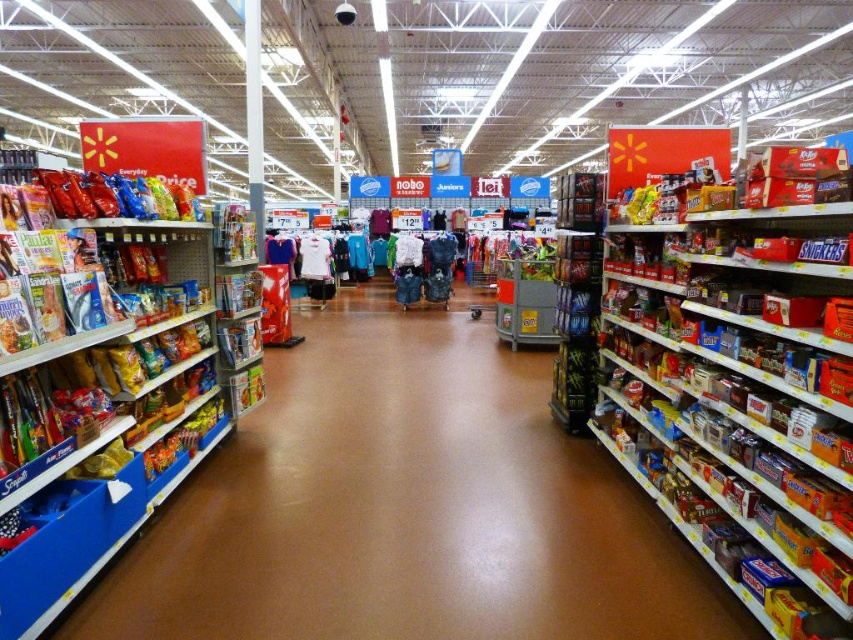
You are a GUI agent. You are given a task and a screenshot of the screen. Output one action in this format:
    pyautogui.click(x=<x>, y=<y>)
    Task: Click on the shiny plastic candy at right
    The height and width of the screenshot is (640, 853).
    Given the screenshot: What is the action you would take?
    pyautogui.click(x=740, y=388)

Between shiny plastic candy at right and matte plastic snack packet at left, which one is positioned higher?

matte plastic snack packet at left is higher up.

Measure the distance between point [790,499] and camera.

Point [790,499] and camera are 7.36 feet apart.

At what (x,y) coordinates should I click in order to perform the action: click on shiny plastic candy at right. Please return your answer as a coordinate pair (x, y). Looking at the image, I should click on (740, 388).

Can you confirm if matte plastic snack at left is wider than shiny plastic candy at right?

Correct, the width of matte plastic snack at left exceeds that of shiny plastic candy at right.

Can you confirm if matte plastic snack at left is positioned above shiny plastic candy at right?

No, matte plastic snack at left is not above shiny plastic candy at right.

You are a GUI agent. You are given a task and a screenshot of the screen. Output one action in this format:
    pyautogui.click(x=<x>, y=<y>)
    Task: Click on the matte plastic snack at left
    The height and width of the screenshot is (640, 853).
    Given the screenshot: What is the action you would take?
    pyautogui.click(x=405, y=508)

Where is `matte plastic snack at left`? This screenshot has width=853, height=640. matte plastic snack at left is located at coordinates (405, 508).

From the picture: Which is more to the left, matte plastic snack at left or matte plastic snack packet at left?

matte plastic snack packet at left

Does matte plastic snack at left appear over matte plastic snack packet at left?

Actually, matte plastic snack at left is below matte plastic snack packet at left.

Between point (583, 520) and point (180, 212), which one is positioned behind?

Positioned behind is point (180, 212).

You are a GUI agent. You are given a task and a screenshot of the screen. Output one action in this format:
    pyautogui.click(x=<x>, y=<y>)
    Task: Click on the matte plastic snack at left
    The height and width of the screenshot is (640, 853).
    Given the screenshot: What is the action you would take?
    pyautogui.click(x=405, y=508)